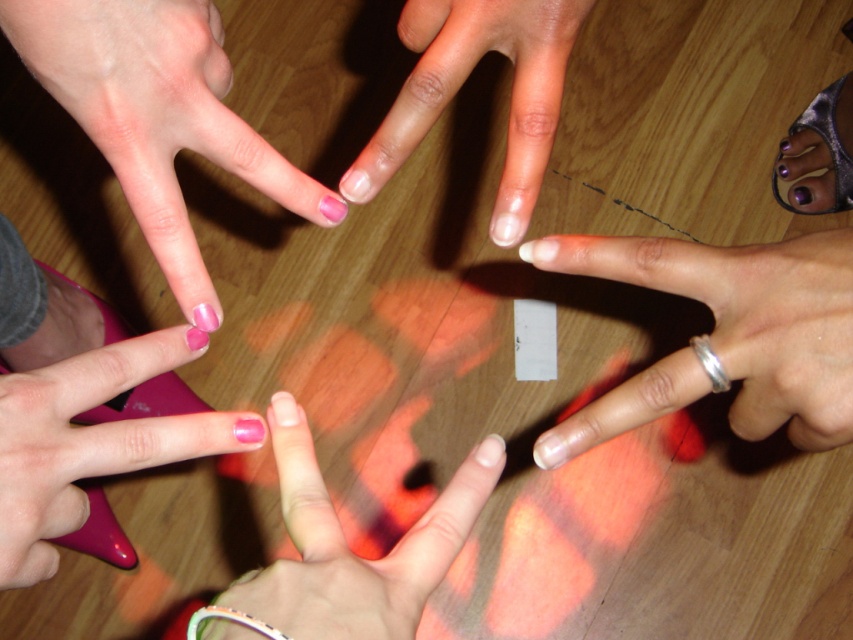
Question: Which is nearer to the pink glossy nail at lower left?

Choices:
 (A) silver metallic bracelet at lower center
 (B) pink polished nails at center

Answer: (A)

Question: Is pink matte nails at center positioned in front of pink polished nails at center?

Choices:
 (A) yes
 (B) no

Answer: (A)

Question: Does pink glossy nail at lower left appear on the left side of pink polished nails at center?

Choices:
 (A) yes
 (B) no

Answer: (A)

Question: Which point is closer to the camera taking this photo?

Choices:
 (A) (564, 241)
 (B) (190, 621)
 (C) (706, 371)

Answer: (B)

Question: Which object is the farthest from the silver metallic bracelet at lower right?

Choices:
 (A) pink glossy nail at lower left
 (B) silver metallic bracelet at lower center
 (C) pink matte nail at center
 (D) pink polished nails at center

Answer: (A)

Question: In this image, where is pink matte nail at center located relative to silver metallic bracelet at lower right?

Choices:
 (A) above
 (B) below

Answer: (B)